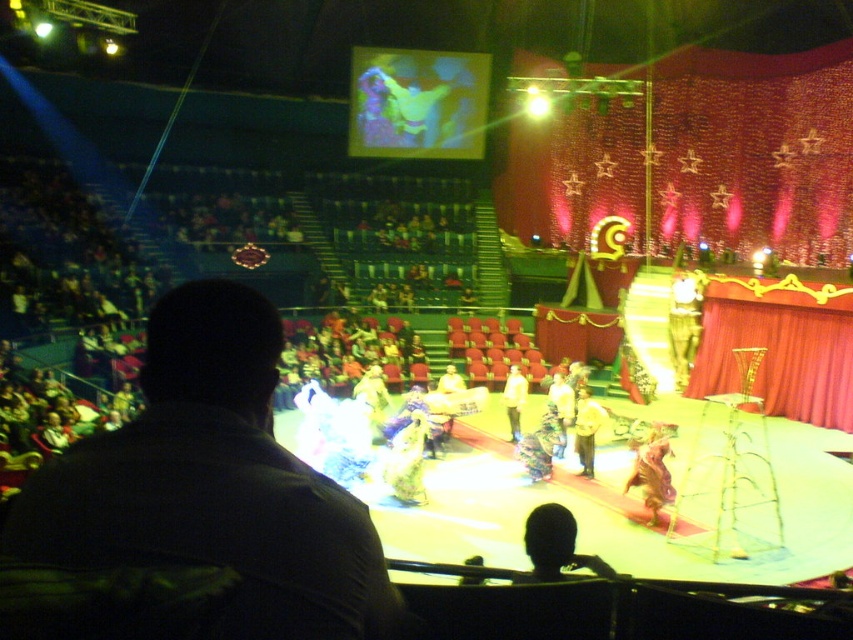
Between yellow fabric pants at center and yellow fabric at center, which one is positioned higher?

yellow fabric at center

Which of these two, yellow fabric pants at center or yellow fabric at center, stands taller?

yellow fabric pants at center is taller.

Which is in front, point (590, 440) or point (511, 424)?

Positioned in front is point (590, 440).

I want to click on yellow fabric pants at center, so click(x=585, y=429).

Is dark brown leather jacket at center above yellow fabric at center?

Incorrect, dark brown leather jacket at center is not positioned above yellow fabric at center.

Is dark brown leather jacket at center closer to the viewer compared to yellow fabric at center?

Yes, dark brown leather jacket at center is closer to the viewer.

What do you see at coordinates (213, 483) in the screenshot? The image size is (853, 640). I see `dark brown leather jacket at center` at bounding box center [213, 483].

The height and width of the screenshot is (640, 853). In order to click on dark brown leather jacket at center in this screenshot , I will do `click(213, 483)`.

Does fluffy brown fur at center have a greater height compared to yellow fabric pants at center?

No, fluffy brown fur at center is not taller than yellow fabric pants at center.

At what (x,y) coordinates should I click in order to perform the action: click on fluffy brown fur at center. Please return your answer as a coordinate pair (x, y). The image size is (853, 640). Looking at the image, I should click on (653, 468).

Between point (637, 464) and point (578, 394), which one is positioned in front?

Positioned in front is point (637, 464).

Where is `fluffy brown fur at center`? The height and width of the screenshot is (640, 853). fluffy brown fur at center is located at coordinates (653, 468).